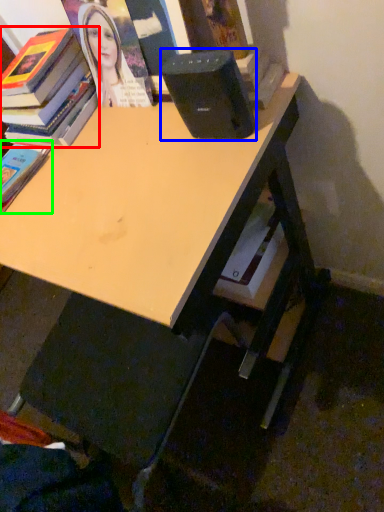
Question: Considering the real-world distances, which object is closest to book (highlighted by a red box)? speaker (highlighted by a blue box) or book (highlighted by a green box).

Choices:
 (A) speaker
 (B) book

Answer: (B)